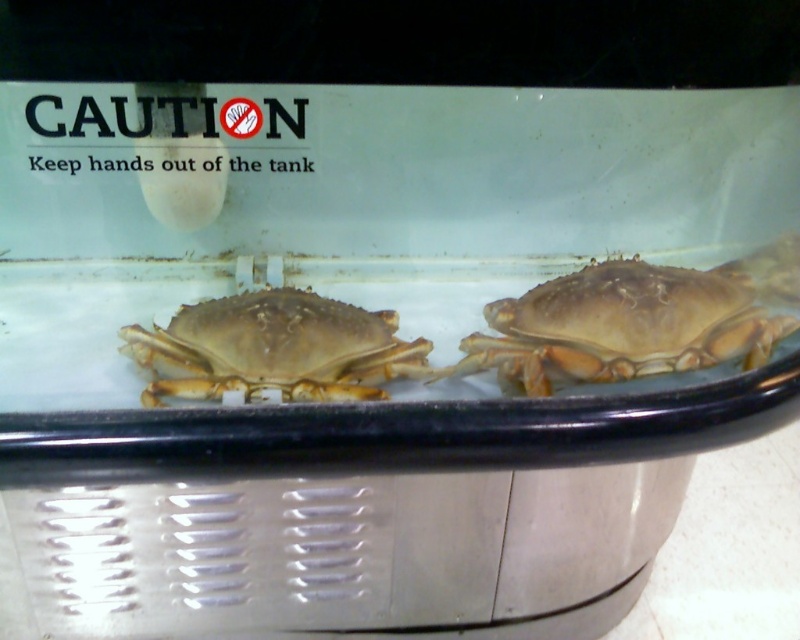
You are a researcher observing the crabs in the tank. You need to record the exact coordinates of the shiny brown crab at right. What are its coordinates?

The coordinates of the shiny brown crab at right are at point (636, 321).

You are a marine biologist observing two crabs in a tank. You notice the shiny brown crab at right and the brown matte crab at center. Which crab has a greater width?

The shiny brown crab at right has a greater width than the brown matte crab at center.

You are a marine biologist observing the crabs in the tank. You notice both the shiny brown crab at right and the brown matte crab at center. Which crab is positioned higher in the tank?

The shiny brown crab at right is above the brown matte crab at center, so it is positioned higher in the tank.